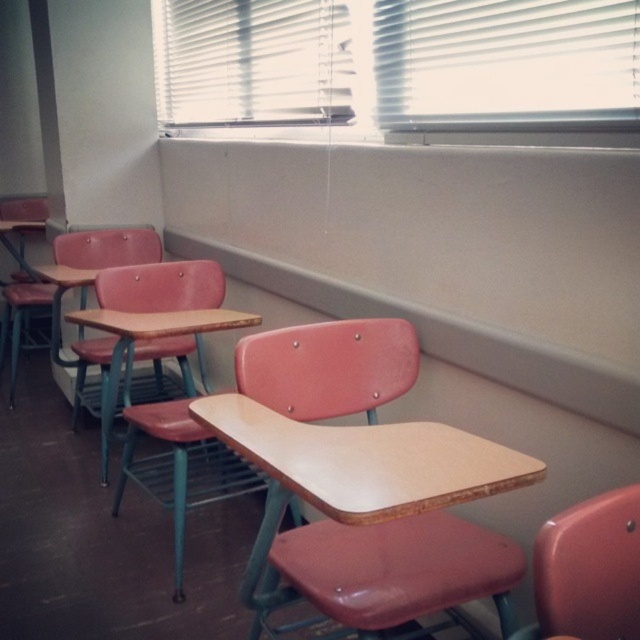
You are a student entering the classroom and want to sit at the matte wood desk at center. To reach it, you must first walk past the white blinds at upper center. Is the desk behind the blinds or in front of them?

The matte wood desk at center is behind the white blinds at upper center, so you will need to walk past the blinds to reach the desk.

You are a student sitting at a desk in the classroom. You notice a point in the image at coordinates (400, 70). What object is located at that point?

The point at coordinates (400, 70) corresponds to the white blinds at upper center.